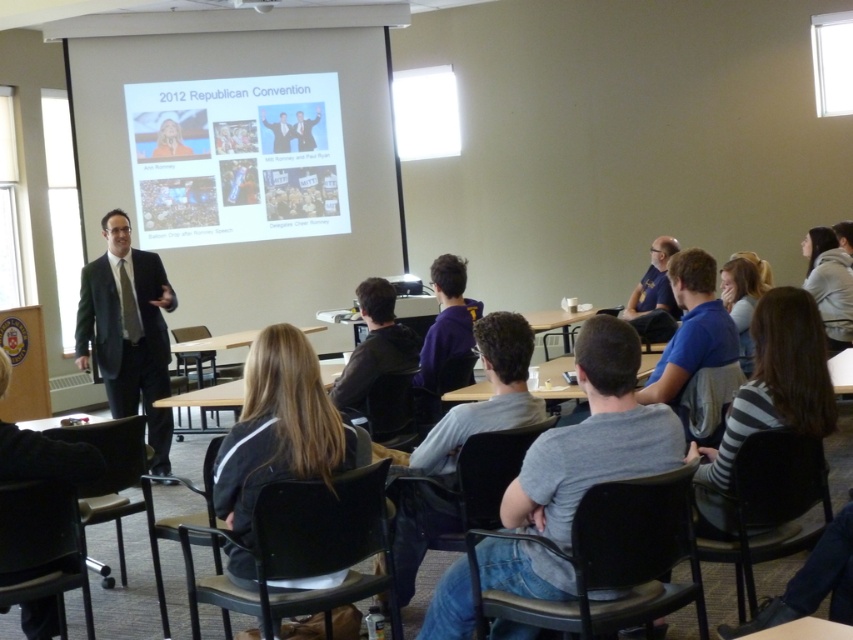
You are a student sitting at the back of the classroom. The white matte projector screen at upper center is where the presentation is displayed. If you want to take a photo of the screen with your phone, which is 15 cm in height, will the screen fit entirely in the photo? Assume your phone camera has a standard 45 degree vertical angle of view.

The white matte projector screen at upper center is 8.14 meters away. Using trigonometry, the maximum height captured at that distance with a 45 degree angle is approximately 8.14 meters. Since the screen is 8.14 meters away and the phone camera can capture up to 8.14 meters vertically, the screen will just barely fit within the photo.

You are a student sitting in the back row of the classroom. You want to look at the dark gray hoodie at center and then the white matte projector screen at upper center. Which object will you need to tilt your head up more to view?

The white matte projector screen at upper center is further to the viewer than the dark gray hoodie at center, so you will need to tilt your head up more to view the white matte projector screen at upper center.

You are a student sitting in the back row of the classroom. You want to take a photo of the dark gray suit at left and the black plastic projector at upper center. Which object will appear larger in your photo?

The dark gray suit at left will appear larger in your photo because it is much taller than the black plastic projector at upper center.